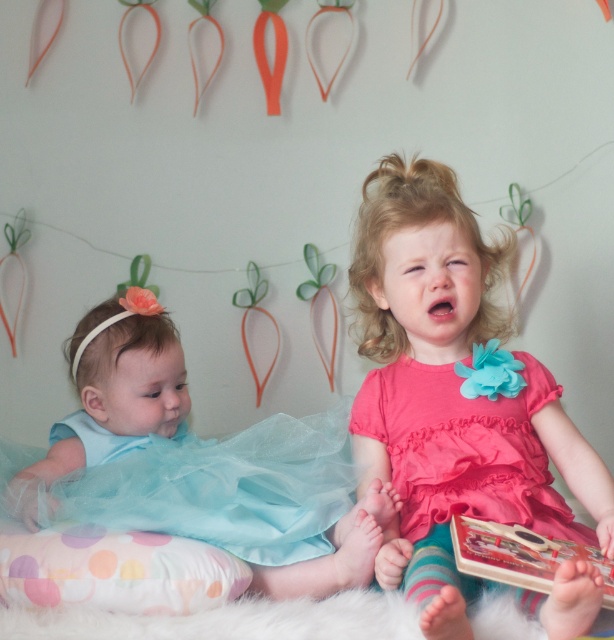
Question: Which point is closer to the camera?

Choices:
 (A) hardcover book at lower right
 (B) pink satin dress at center

Answer: (B)

Question: Among these objects, which one is farthest from the camera?

Choices:
 (A) pink satin dress at center
 (B) light blue tulle dress at lower left
 (C) hardcover book at lower right

Answer: (B)

Question: Observing the image, what is the correct spatial positioning of pink satin dress at center in reference to light blue tulle dress at lower left?

Choices:
 (A) above
 (B) below

Answer: (A)

Question: Estimate the real-world distances between objects in this image. Which object is farther from the light blue tulle dress at lower left?

Choices:
 (A) pink satin dress at center
 (B) hardcover book at lower right

Answer: (B)

Question: Is light blue tulle dress at lower left wider than hardcover book at lower right?

Choices:
 (A) yes
 (B) no

Answer: (A)

Question: Is pink satin dress at center smaller than hardcover book at lower right?

Choices:
 (A) yes
 (B) no

Answer: (B)